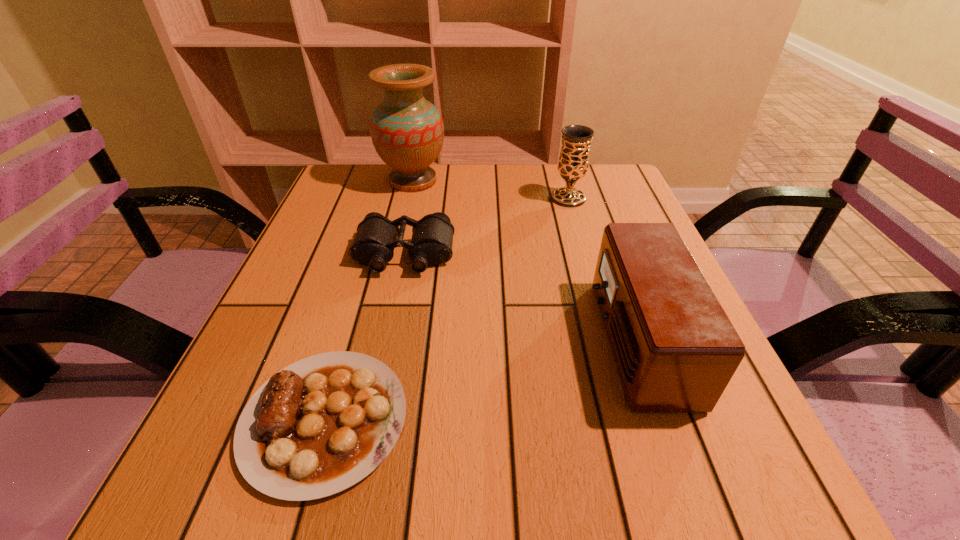
The width and height of the screenshot is (960, 540). Identify the location of vacant space located on the front-facing side of the radio receiver. (380, 340).

The image size is (960, 540). What are the coordinates of `vacant area situated through the eyepieces of the fourth tallest object` in the screenshot? It's located at (396, 295).

Find the location of a particular element. free space located 0.210m on the right of the steak is located at coordinates (x=549, y=420).

Identify the location of vase present at the far edge. (407, 131).

Image resolution: width=960 pixels, height=540 pixels. I want to click on chalice situated at the far edge, so click(x=573, y=163).

I want to click on object that is at the near edge, so click(x=322, y=424).

Where is `vase that is at the left edge`? vase that is at the left edge is located at coordinates (407, 131).

The image size is (960, 540). In order to click on binoculars located in the left edge section of the desktop in this screenshot , I will do `click(432, 236)`.

I want to click on steak located at the left edge, so click(322, 424).

Find the location of a particular element. The image size is (960, 540). chalice positioned at the right edge is located at coordinates (573, 163).